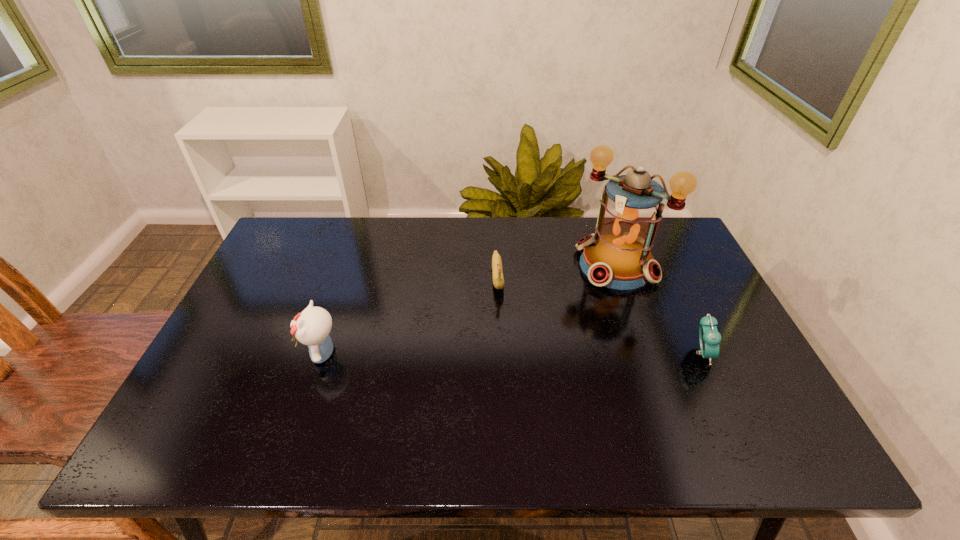
You are a GUI agent. You are given a task and a screenshot of the screen. Output one action in this format:
    pyautogui.click(x=<x>, y=<y>)
    Task: Click on the vacant space at the near edge of the desktop
    The image size is (960, 540).
    Given the screenshot: What is the action you would take?
    pyautogui.click(x=319, y=413)

The height and width of the screenshot is (540, 960). What are the coordinates of `blank space at the left edge` in the screenshot? It's located at (235, 367).

You are a GUI agent. You are given a task and a screenshot of the screen. Output one action in this format:
    pyautogui.click(x=<x>, y=<y>)
    Task: Click on the free spot at the right edge of the desktop
    
    Given the screenshot: What is the action you would take?
    pyautogui.click(x=690, y=343)

Identify the location of vacant region at the far left corner of the desktop. (297, 230).

In the image, there is a desktop. Where is `free space at the far right corner`? free space at the far right corner is located at coordinates (673, 220).

Locate an element on the screen. Image resolution: width=960 pixels, height=540 pixels. free space between the lantern and the kitten is located at coordinates (469, 309).

Locate an element on the screen. vacant space that's between the banana and the tallest object is located at coordinates (557, 271).

In order to click on vacant space that's between the second object from left to right and the alarm clock in this screenshot , I will do `click(600, 314)`.

The height and width of the screenshot is (540, 960). In order to click on vacant space that is in between the second tallest object and the banana in this screenshot , I will do 410,314.

I want to click on free space between the kitten and the banana, so click(410, 314).